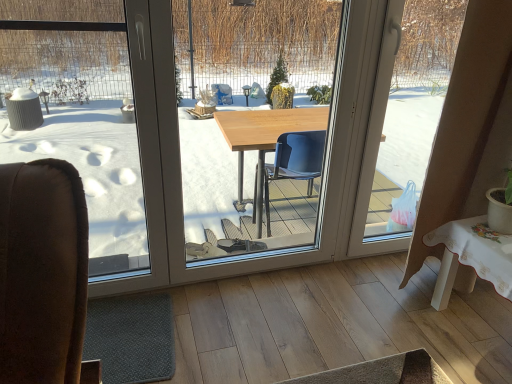
At what (x,y) coordinates should I click in order to perform the action: click on vacant space in front of transparent plastic bag at right, the third window screen when ordered from left to right. Please return your answer as a coordinate pair (x, y). Looking at the image, I should click on (379, 288).